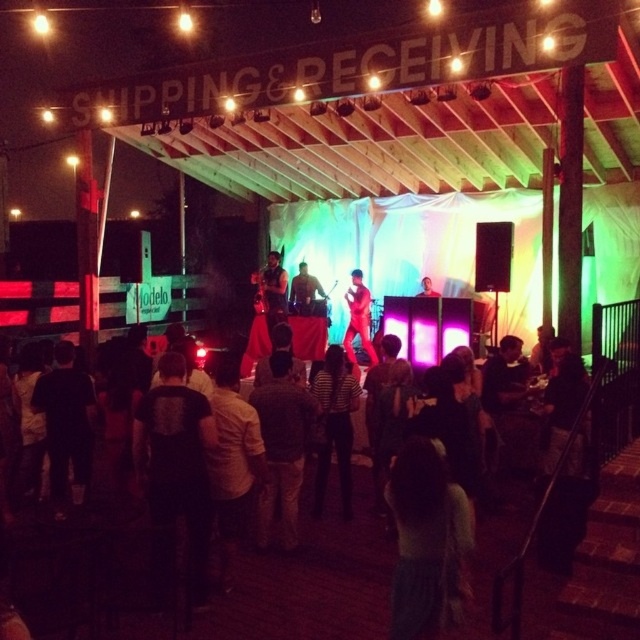
Question: Considering the real-world distances, which object is closest to the shiny black guitar at center?

Choices:
 (A) matte black guitar at center
 (B) shiny red jacket at center
 (C) matte red shirt at center
 (D) black fabric crowd at center

Answer: (A)

Question: Does light green sweater at lower center appear on the right side of striped shirt at center?

Choices:
 (A) no
 (B) yes

Answer: (B)

Question: Which point is closer to the camera?

Choices:
 (A) shiny red jacket at center
 (B) shiny black guitar at center

Answer: (A)

Question: Which point is farther to the camera?

Choices:
 (A) black fabric crowd at center
 (B) matte black guitar at center

Answer: (B)

Question: Is light green sweater at lower center wider than matte black guitar at center?

Choices:
 (A) yes
 (B) no

Answer: (B)

Question: Does striped shirt at center have a smaller size compared to shiny red jacket at center?

Choices:
 (A) no
 (B) yes

Answer: (B)